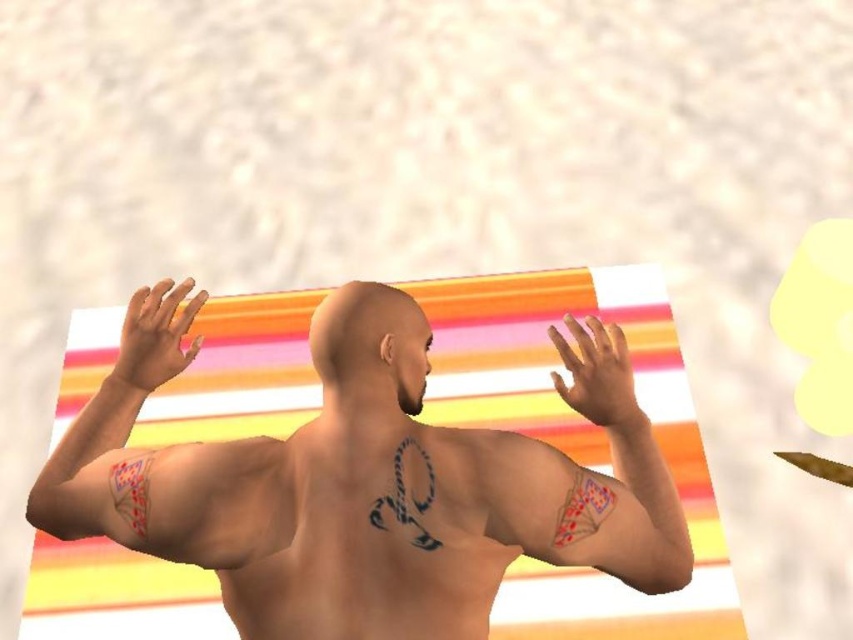
You are an artist trying to replicate the tattoos on the person in the image. You have two tattoo stencils. One is for the smooth skin tattoo at center and the other for the smooth skin tattoo at left. Which stencil should you use first if you want to start with the wider tattoo?

You should start with the smooth skin tattoo at center because its width is larger than the smooth skin tattoo at left, making it the wider one.

You are an artist trying to sketch the back of the person in the image. You want to focus on the area at point (590,477). What will you find there?

At point (590,477) lies smooth skin tattoo at center.

You are an artist trying to sketch this scene. If you focus on the smooth skin man at center and the smooth skin tattoo at left, which one should you draw first to ensure proper layering?

The smooth skin man at center should be drawn first because he is in front of the smooth skin tattoo at left, so layering him over the tattoo would create the correct spatial relationship.